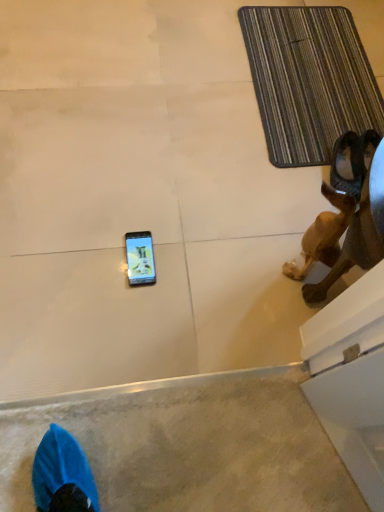
Locate an element on the screen. free space above striped fabric bath mat at upper right (from a real-world perspective) is located at coordinates (322, 59).